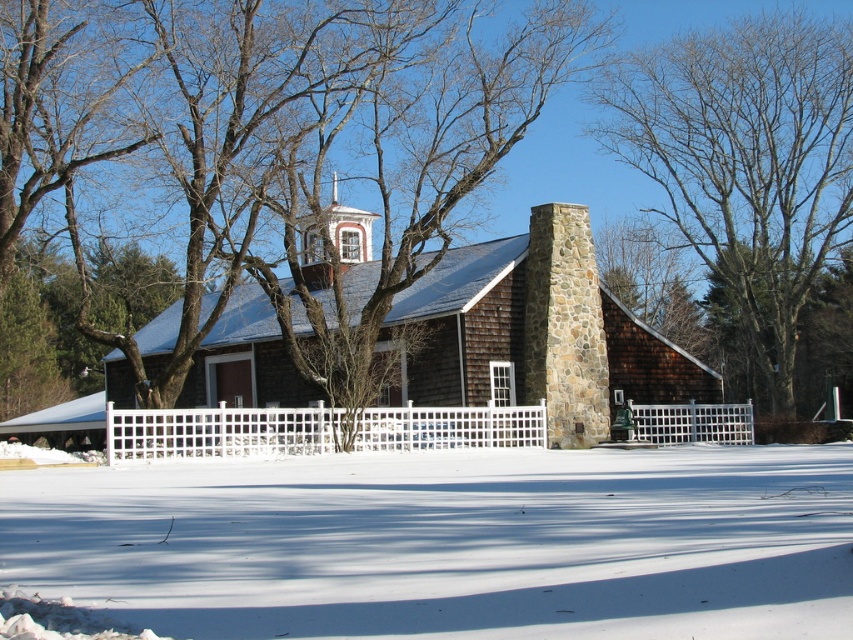
You are an architect designing a new garden layout for the property around the brown wooden church at center and the bare branches at center. Considering their sizes, which object should you place closer to the entrance to ensure visibility?

The brown wooden church at center is larger in size than the bare branches at center, so placing the church closer to the entrance will ensure it remains the focal point and is more visible from the entrance.

You are a delivery person trying to reach the brown wooden church at center. You are currently standing on the white powdery snow at lower center. Is the snow under the church or in front of it?

The white powdery snow at lower center is positioned under brown wooden church at center, so the snow is under the church.

You are standing in front of the rustic building and want to determine the relative positions of two points marked on the roof. Which point is closer to you, point (708,529) or point (834,44)?

Point (708,529) is closer to the viewer than point (834,44).